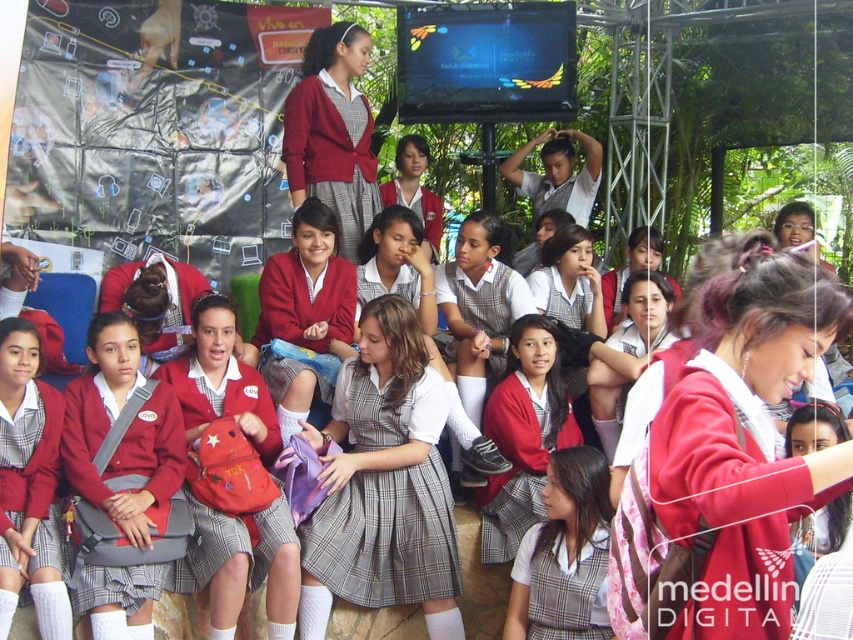
Which is more to the left, plaid cotton dress at center or plaid fabric skirt at center?

plaid cotton dress at center is more to the left.

Does plaid cotton dress at center lie behind plaid fabric skirt at center?

Yes.

This screenshot has height=640, width=853. What do you see at coordinates (386, 538) in the screenshot?
I see `plaid cotton dress at center` at bounding box center [386, 538].

You are a GUI agent. You are given a task and a screenshot of the screen. Output one action in this format:
    pyautogui.click(x=<x>, y=<y>)
    Task: Click on the plaid cotton dress at center
    This screenshot has height=640, width=853.
    Given the screenshot: What is the action you would take?
    pyautogui.click(x=386, y=538)